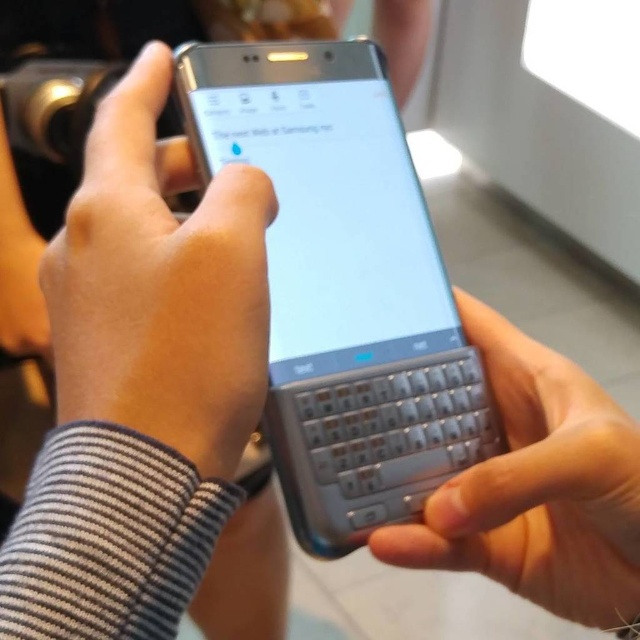
You are trying to locate the slate metallic keyboard at center in the image. Given that the coordinate system starts at the bottom left corner of the image with coordinates 0,0, can you determine if the slate metallic keyboard at center is positioned above or below the point with coordinates [342,285]?

The point [342,285] corresponds to the slate metallic keyboard at center, so it is exactly at that coordinate, neither above nor below.

You are a photographer trying to focus on two points in the image. The first point is at coordinate point (193, 332) and the second is at coordinate point (564, 368). Which point is easier to focus on due to being closer to the camera?

Point (193, 332) is closer to the camera than point (564, 368), so it is easier to focus on.

You are designing a virtual reality interface that needs to display a 3D model of the matte black phone at center. What are the coordinates where you should place the phone in the virtual environment based on the image?

The coordinates for the matte black phone at center should be set to point (x=160, y=285) in the virtual environment.